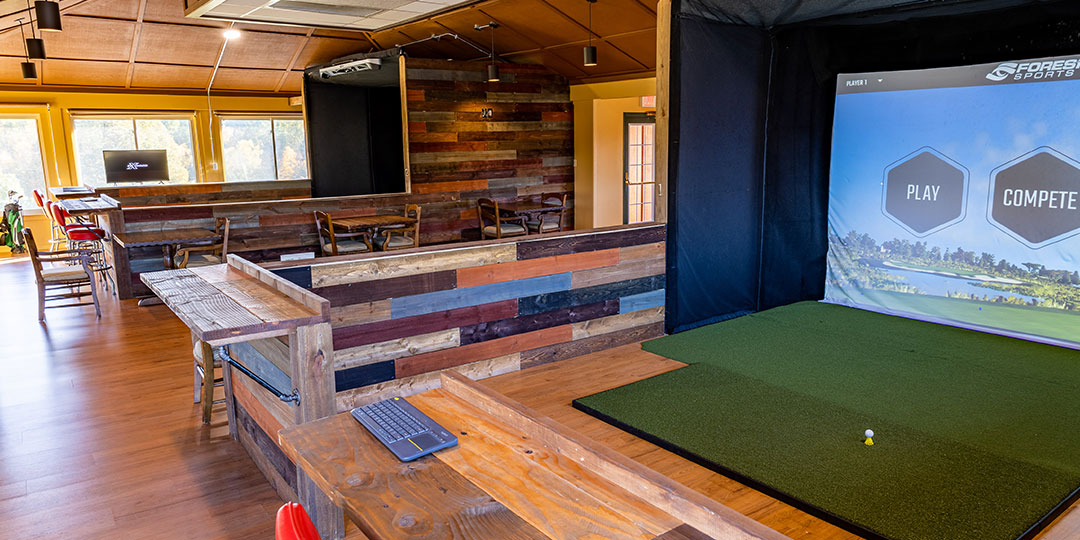
Identify the location of stool. Image resolution: width=1080 pixels, height=540 pixels. (217, 379).